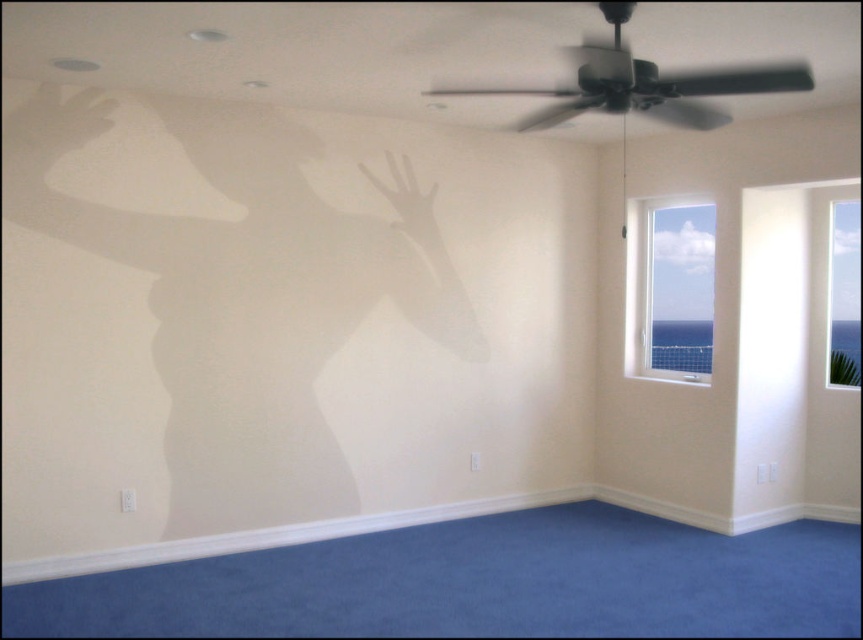
Is transparent glass window at upper right positioned behind translucent white hand at center?

Yes, transparent glass window at upper right is behind translucent white hand at center.

Which is in front, point (657, 282) or point (430, 228)?

Positioned in front is point (430, 228).

Is point (647, 316) less distant than point (402, 184)?

No, it is behind (402, 184).

Identify the location of transparent glass window at upper right. [x=673, y=291].

Who is positioned more to the left, transparent glass window at right or matte white hand at upper left?

Positioned to the left is matte white hand at upper left.

What do you see at coordinates (843, 294) in the screenshot?
I see `transparent glass window at right` at bounding box center [843, 294].

What are the coordinates of `transparent glass window at right` in the screenshot? It's located at (843, 294).

Who is more forward, (709, 241) or (52, 134)?

Point (52, 134)

Is transparent glass window at upper right shorter than transparent plastic hand at upper left?

No, transparent glass window at upper right is not shorter than transparent plastic hand at upper left.

This screenshot has width=863, height=640. What are the coordinates of `transparent glass window at upper right` in the screenshot? It's located at (673, 291).